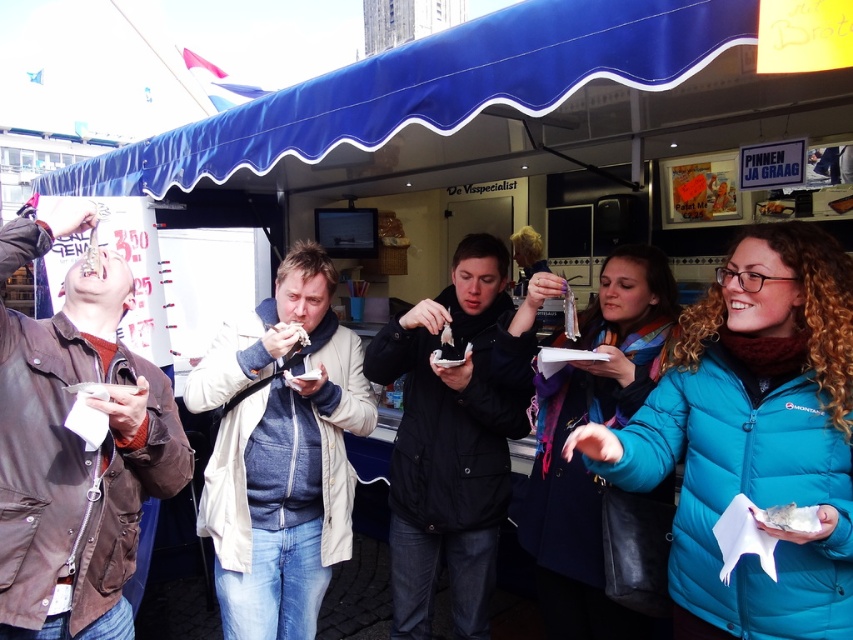
Is shiny silver spoon at center wider than white paper at center?

Indeed, shiny silver spoon at center has a greater width compared to white paper at center.

The width and height of the screenshot is (853, 640). I want to click on shiny silver spoon at center, so click(770, 208).

Can you confirm if brown leather jacket at left is positioned to the left of white paper food at lower right?

Indeed, brown leather jacket at left is positioned on the left side of white paper food at lower right.

Where is `brown leather jacket at left`? Image resolution: width=853 pixels, height=640 pixels. brown leather jacket at left is located at coordinates (78, 461).

Does point (28, 333) come closer to viewer compared to point (811, 512)?

No, (28, 333) is further to viewer.

Find the location of a particular element. The image size is (853, 640). brown leather jacket at left is located at coordinates (78, 461).

Which is above, blue fabric canopy at upper center or blue wool scarf at center?

blue fabric canopy at upper center is above.

Is blue fabric canopy at upper center in front of blue wool scarf at center?

Yes, it is.

Does point (618, 35) lie behind point (601, 376)?

No.

You are a GUI agent. You are given a task and a screenshot of the screen. Output one action in this format:
    pyautogui.click(x=<x>, y=<y>)
    Task: Click on the blue fabric canopy at upper center
    The height and width of the screenshot is (640, 853).
    Given the screenshot: What is the action you would take?
    pyautogui.click(x=431, y=88)